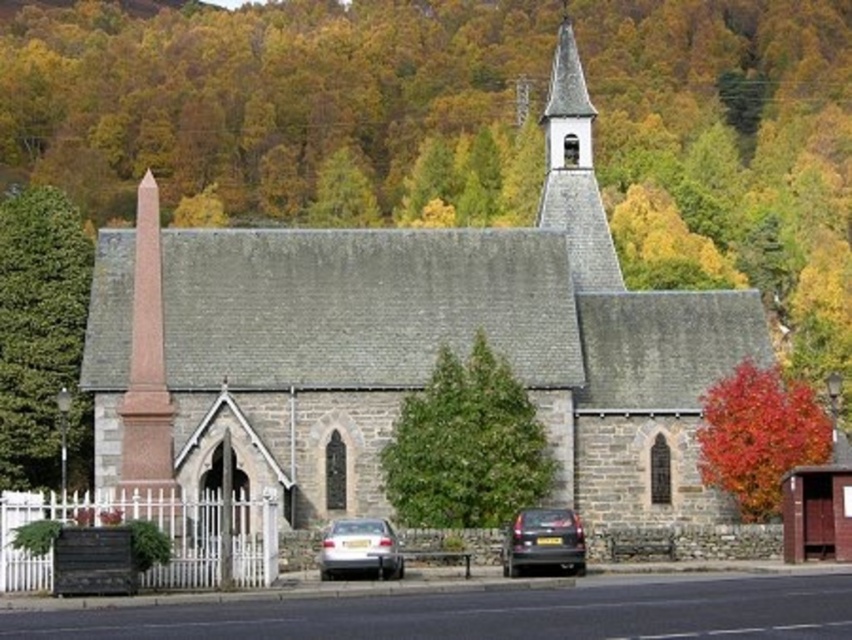
From the picture: You are standing in front of the church and want to walk towards the green leafy tree at left and the pink polished stone obelisk at left. Which object will you reach first?

The green leafy tree at left is closer to you than the pink polished stone obelisk at left, so you will reach the green leafy tree at left first.

You are a photographer planning to capture the church and its surroundings. You want to ensure that the smooth gray steeple at upper center is visible above the autumn leaves at right in your photo. Based on their positions, will the steeple be visible above the leaves?

The autumn leaves at right is below the smooth gray steeple at upper center, so the steeple will be visible above the leaves in the photo.